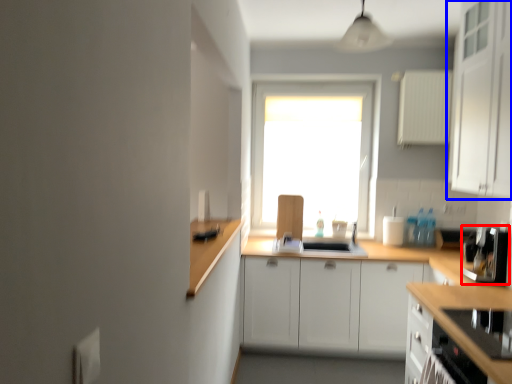
Question: Which point is further to the camera, coffee machine (highlighted by a red box) or cabinetry (highlighted by a blue box)?

Choices:
 (A) coffee machine
 (B) cabinetry

Answer: (A)